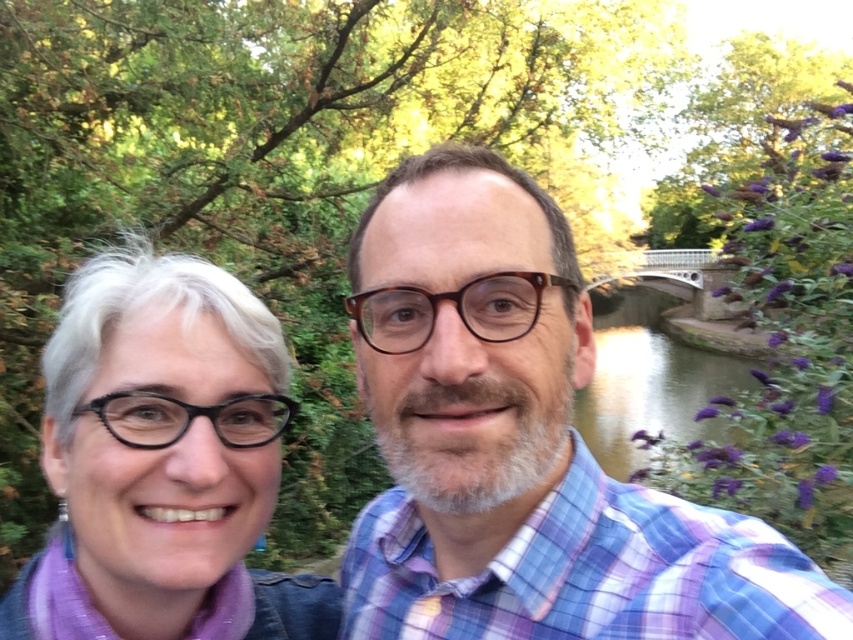
Who is more forward, (439, 225) or (244, 536)?

Point (439, 225)

Does blue plaid shirt at center have a greater height compared to matte black glasses at left?

Correct, blue plaid shirt at center is much taller as matte black glasses at left.

Who is more distant from viewer, (502,477) or (64,364)?

Positioned behind is point (64,364).

Image resolution: width=853 pixels, height=640 pixels. I want to click on blue plaid shirt at center, so [521, 444].